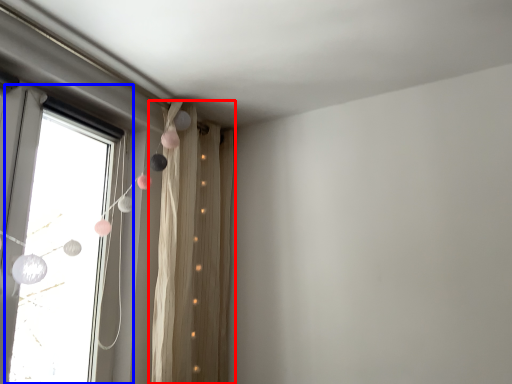
Question: Which object is closer to the camera taking this photo, curtain (highlighted by a red box) or window (highlighted by a blue box)?

Choices:
 (A) curtain
 (B) window

Answer: (B)